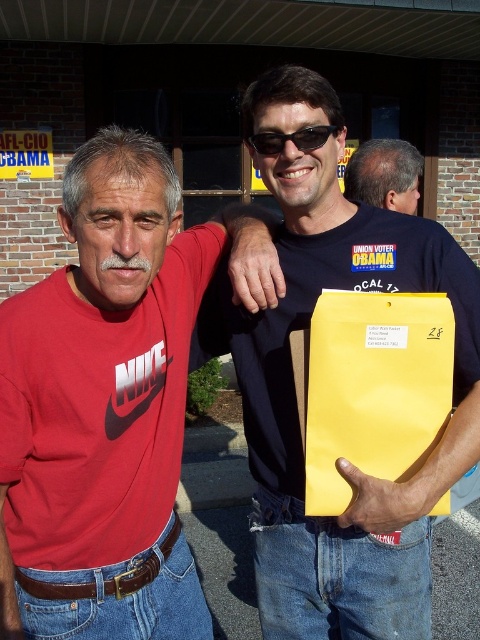
Question: Is matte black shirt at center smaller than black plastic sunglasses at center?

Choices:
 (A) no
 (B) yes

Answer: (A)

Question: Which object is farther from the camera taking this photo?

Choices:
 (A) gray hair at upper center
 (B) yellow paper envelope at center

Answer: (A)

Question: Does yellow paper envelope at center appear over gray hair at upper center?

Choices:
 (A) no
 (B) yes

Answer: (A)

Question: Which is farther from the black plastic sunglasses at center?

Choices:
 (A) matte red t-shirt at left
 (B) matte black shirt at center
 (C) gray hair at upper center

Answer: (C)

Question: Estimate the real-world distances between objects in this image. Which object is closer to the matte black shirt at center?

Choices:
 (A) gray hair at upper center
 (B) yellow paper envelope at center

Answer: (B)

Question: Is matte red t-shirt at left positioned before black plastic sunglasses at center?

Choices:
 (A) no
 (B) yes

Answer: (B)